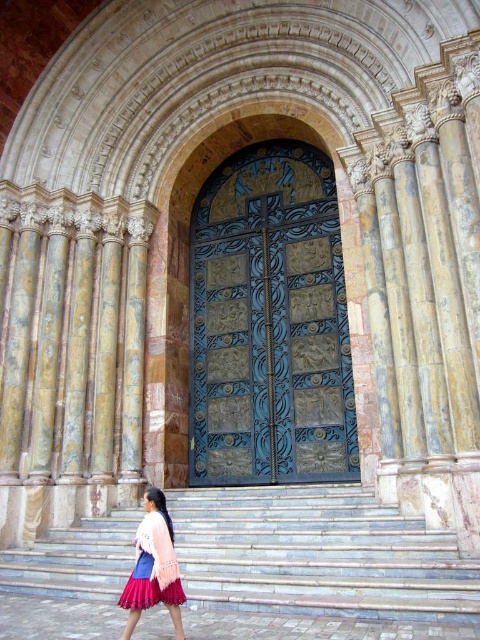
You are standing at the entrance of the building and see the smooth stone stairs at center and the pink knitted sweater at lower left. Which object is located to the right of the other?

The smooth stone stairs at center is positioned on the right side of pink knitted sweater at lower left.

You are standing in front of the grand entrance and notice both the blue patinated metal door at center and the pink knitted sweater at lower left. Which object is positioned more to the left side of the entrance?

The pink knitted sweater at lower left is positioned more to the left side of the entrance than the blue patinated metal door at center.

You are standing in front of the grand entrance and notice both the blue patinated metal door at center and the pink knitted sweater at lower left. Which object is closer to you?

The blue patinated metal door at center is closer to you since it is further to the viewer than the pink knitted sweater at lower left.